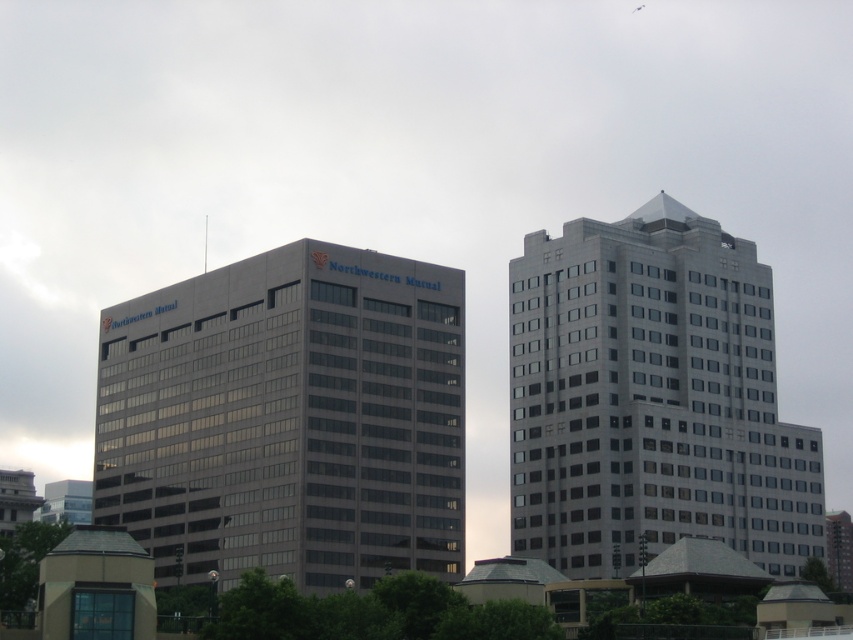
Can you confirm if gray glass building at center is smaller than sleek silver building at right?

No, gray glass building at center is not smaller than sleek silver building at right.

Is point (183, 349) farther from viewer compared to point (767, 520)?

No, (183, 349) is closer to viewer.

Which is behind, point (108, 346) or point (618, 440)?

The point (108, 346) is behind.

In order to click on gray glass building at center in this screenshot , I will do `click(288, 419)`.